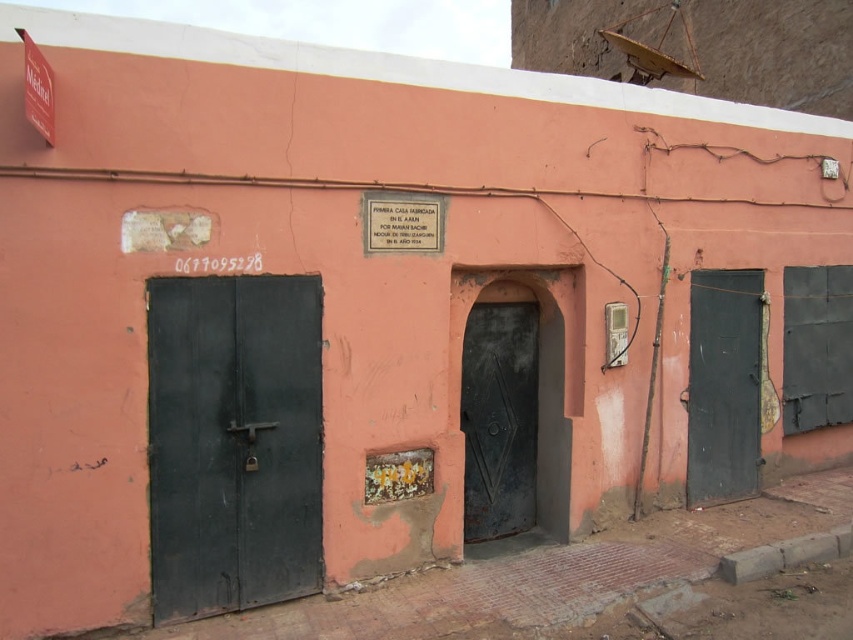
You are a delivery person standing at the entrance of the building and need to place a camera 4.32 meters away from the matte black door at left. Where should you position the camera?

The camera should be placed 4.32 meters away from the matte black door at left to meet the requirement.

You are standing in front of the building and want to enter through the matte black door at left. Based on its 2D coordinates, is the door located in the upper or lower half of the building?

The matte black door at left is located at point (233, 442). Since the y coordinate is 0.274, which is less than 0.5, the door is in the lower half of the building.